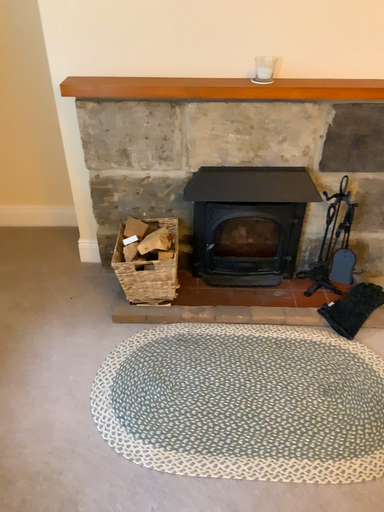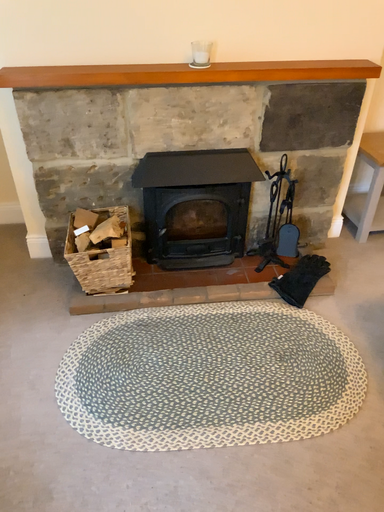
Question: Which way did the camera rotate in the video?

Choices:
 (A) rotated right
 (B) rotated left

Answer: (A)